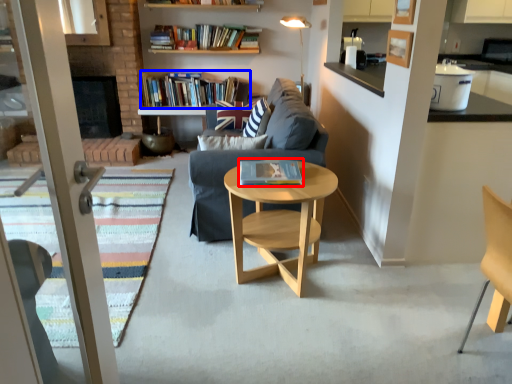
Question: Among these objects, which one is farthest to the camera, book (highlighted by a red box) or book (highlighted by a blue box)?

Choices:
 (A) book
 (B) book

Answer: (B)